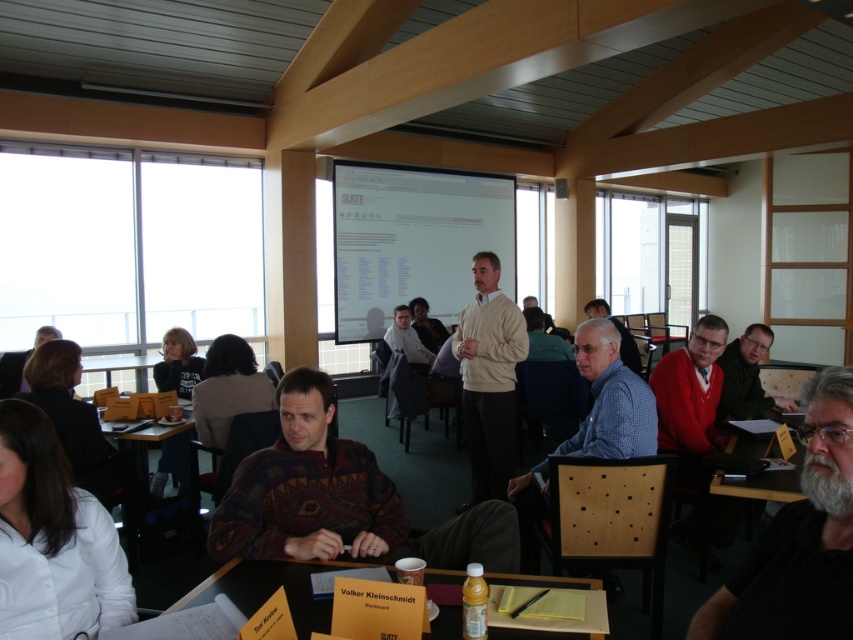
Question: Does multicolored knitted sweater at center have a lesser width compared to blue shirt at center?

Choices:
 (A) no
 (B) yes

Answer: (A)

Question: Is multicolored knitted sweater at center positioned at the back of dark brown sweater at lower left?

Choices:
 (A) yes
 (B) no

Answer: (B)

Question: Can you confirm if multicolored knitted sweater at center is smaller than matte brown sweater at center?

Choices:
 (A) yes
 (B) no

Answer: (A)

Question: Which point is closer to the camera taking this photo?

Choices:
 (A) (723, 588)
 (B) (538, 632)
 (C) (650, 428)
 (D) (265, 486)

Answer: (A)

Question: Which point appears farthest from the camera in this image?

Choices:
 (A) click(816, 403)
 (B) click(61, 337)
 (C) click(633, 364)
 (D) click(752, 380)

Answer: (C)

Question: Which point is closer to the camera?

Choices:
 (A) beige sweater at center
 (B) blue checkered shirt at center
 (C) dark brown sweater at lower left

Answer: (B)